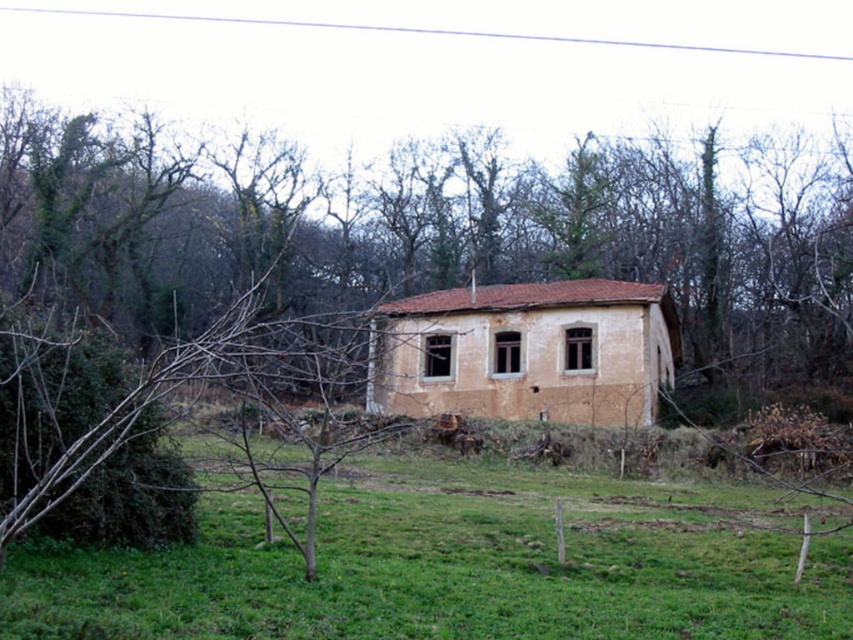
Who is taller, green grass at center or brown textured house at center?

Standing taller between the two is brown textured house at center.

Is point (561, 477) behind point (494, 358)?

That is False.

Is point (459, 621) positioned before point (437, 372)?

Yes, it is in front of point (437, 372).

The image size is (853, 640). In order to click on green grass at center in this screenshot , I will do `click(457, 564)`.

Is point (405, 276) more distant than point (550, 321)?

Yes, it is behind point (550, 321).

Where is `brown bark tree at center`? brown bark tree at center is located at coordinates [x=431, y=228].

In the scene shown: Can you confirm if brown bark tree at center is taller than green grass at center?

Correct, brown bark tree at center is much taller as green grass at center.

At what (x,y) coordinates should I click in order to perform the action: click on brown bark tree at center. Please return your answer as a coordinate pair (x, y). Looking at the image, I should click on (431, 228).

Identify the location of brown bark tree at center. This screenshot has width=853, height=640. (431, 228).